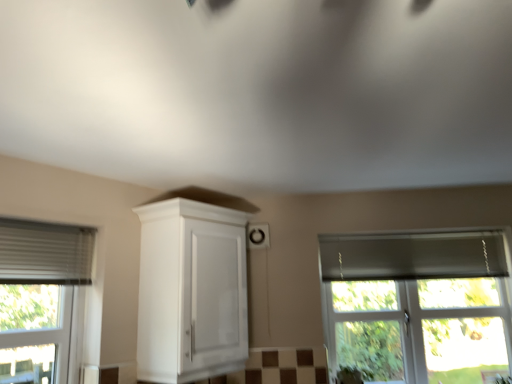
Question: From a real-world perspective, is transparent glass window at right under white glossy cabinet at center?

Choices:
 (A) no
 (B) yes

Answer: (B)

Question: Can you confirm if transparent glass window at right is shorter than white glossy cabinet at center?

Choices:
 (A) no
 (B) yes

Answer: (A)

Question: Could you tell me if transparent glass window at right is turned towards white glossy cabinet at center?

Choices:
 (A) no
 (B) yes

Answer: (A)

Question: Considering the relative sizes of transparent glass window at right and white glossy cabinet at center in the image provided, is transparent glass window at right bigger than white glossy cabinet at center?

Choices:
 (A) yes
 (B) no

Answer: (B)

Question: Are transparent glass window at right and white glossy cabinet at center located far from each other?

Choices:
 (A) yes
 (B) no

Answer: (A)

Question: From a real-world perspective, is transparent glass window at right on top of white glossy cabinet at center?

Choices:
 (A) yes
 (B) no

Answer: (B)

Question: Does white glossy cabinet at center lie behind transparent glass window at right?

Choices:
 (A) no
 (B) yes

Answer: (A)

Question: Would you say white glossy cabinet at center is outside transparent glass window at right?

Choices:
 (A) no
 (B) yes

Answer: (B)

Question: Is white glossy cabinet at center turned away from transparent glass window at right?

Choices:
 (A) yes
 (B) no

Answer: (B)

Question: From the image's perspective, is white glossy cabinet at center under transparent glass window at right?

Choices:
 (A) no
 (B) yes

Answer: (A)

Question: From a real-world perspective, is white glossy cabinet at center under transparent glass window at right?

Choices:
 (A) yes
 (B) no

Answer: (B)

Question: Is white glossy cabinet at center thinner than transparent glass window at right?

Choices:
 (A) yes
 (B) no

Answer: (B)

Question: Is white glossy cabinet at center inside the boundaries of transparent glass window at right, or outside?

Choices:
 (A) outside
 (B) inside

Answer: (A)